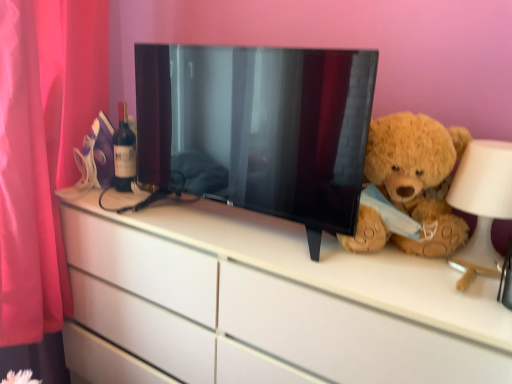
Question: Is black glossy tv at center closer to camera compared to matte glass bottle at left?

Choices:
 (A) no
 (B) yes

Answer: (B)

Question: Does black glossy tv at center have a greater height compared to matte glass bottle at left?

Choices:
 (A) no
 (B) yes

Answer: (B)

Question: Is black glossy tv at center far away from matte glass bottle at left?

Choices:
 (A) yes
 (B) no

Answer: (B)

Question: Is matte glass bottle at left a part of black glossy tv at center?

Choices:
 (A) yes
 (B) no

Answer: (B)

Question: Is black glossy tv at center in contact with matte glass bottle at left?

Choices:
 (A) yes
 (B) no

Answer: (B)

Question: In the image, is white glossy chest of drawers at center positioned in front of or behind white matte table lamp at right?

Choices:
 (A) front
 (B) behind

Answer: (A)

Question: In terms of width, does white glossy chest of drawers at center look wider or thinner when compared to white matte table lamp at right?

Choices:
 (A) thin
 (B) wide

Answer: (B)

Question: In the image, is white glossy chest of drawers at center on the left side or the right side of white matte table lamp at right?

Choices:
 (A) left
 (B) right

Answer: (A)

Question: From a real-world perspective, is white glossy chest of drawers at center physically located above or below white matte table lamp at right?

Choices:
 (A) above
 (B) below

Answer: (B)

Question: In the image, is matte glass bottle at left positioned in front of or behind black glossy tv at center?

Choices:
 (A) behind
 (B) front

Answer: (A)

Question: From a real-world perspective, is matte glass bottle at left physically located above or below black glossy tv at center?

Choices:
 (A) below
 (B) above

Answer: (A)

Question: Considering the positions of point (115, 170) and point (311, 99), is point (115, 170) closer or farther from the camera than point (311, 99)?

Choices:
 (A) closer
 (B) farther

Answer: (B)

Question: In terms of width, does matte glass bottle at left look wider or thinner when compared to black glossy tv at center?

Choices:
 (A) wide
 (B) thin

Answer: (B)

Question: Is black glossy tv at center inside or outside of matte glass bottle at left?

Choices:
 (A) outside
 (B) inside

Answer: (A)

Question: Based on their positions, is black glossy tv at center located to the left or right of matte glass bottle at left?

Choices:
 (A) right
 (B) left

Answer: (A)